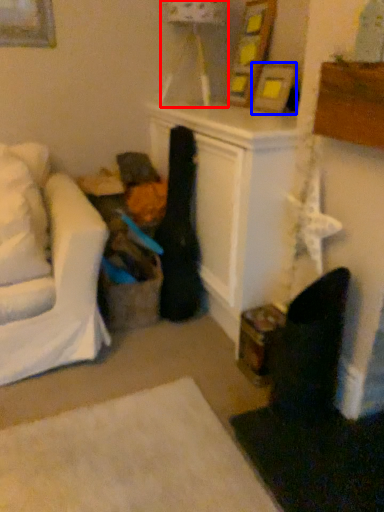
Question: Which object is further to the camera taking this photo, lamp (highlighted by a red box) or picture frame (highlighted by a blue box)?

Choices:
 (A) lamp
 (B) picture frame

Answer: (A)